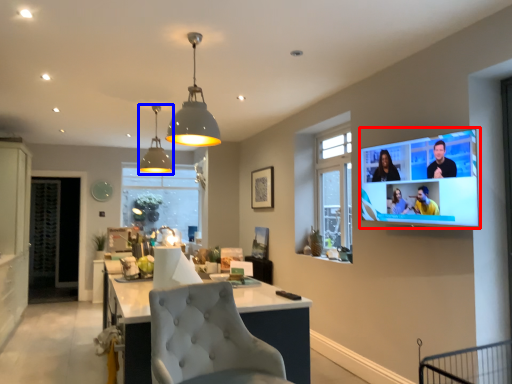
Question: Which object is further to the camera taking this photo, tv show (highlighted by a red box) or lamp (highlighted by a blue box)?

Choices:
 (A) tv show
 (B) lamp

Answer: (B)